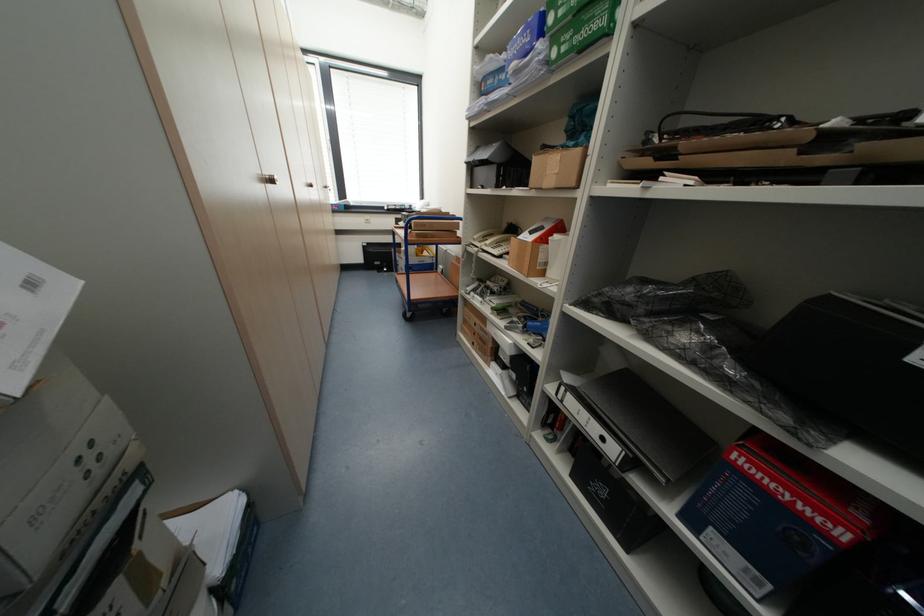
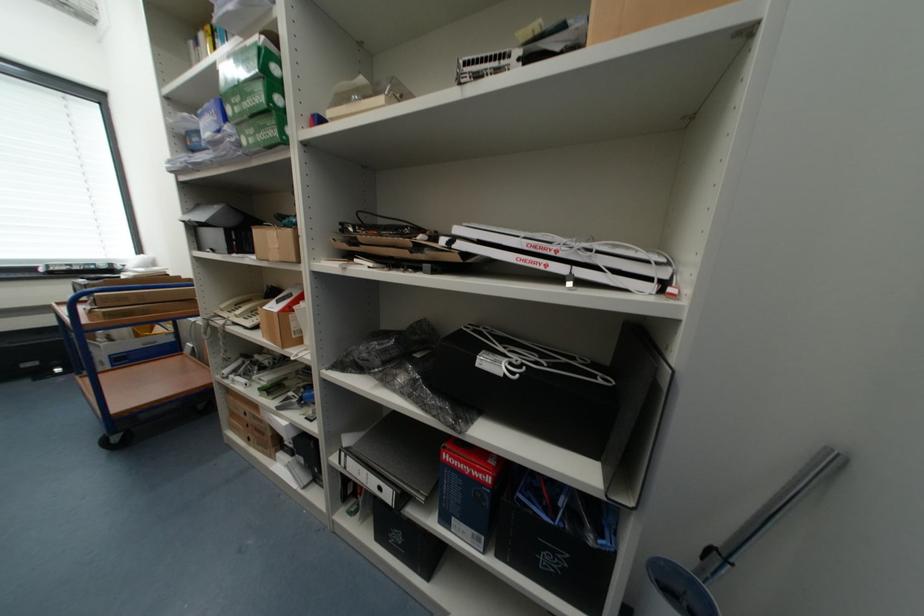
Question: How did the camera likely rotate?

Choices:
 (A) Left
 (B) Right
 (C) Up
 (D) Down

Answer: (B)